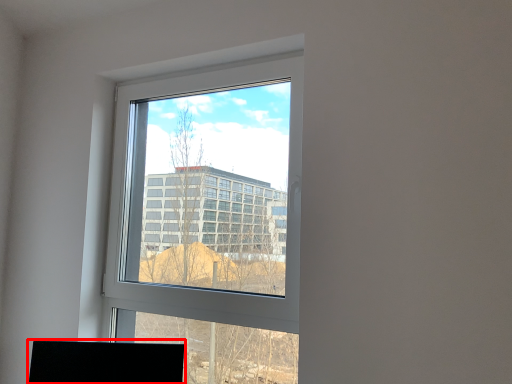
Question: Considering the relative positions of desktop (annotated by the red box) and window in the image provided, where is desktop (annotated by the red box) located with respect to the staircase?

Choices:
 (A) right
 (B) left

Answer: (B)